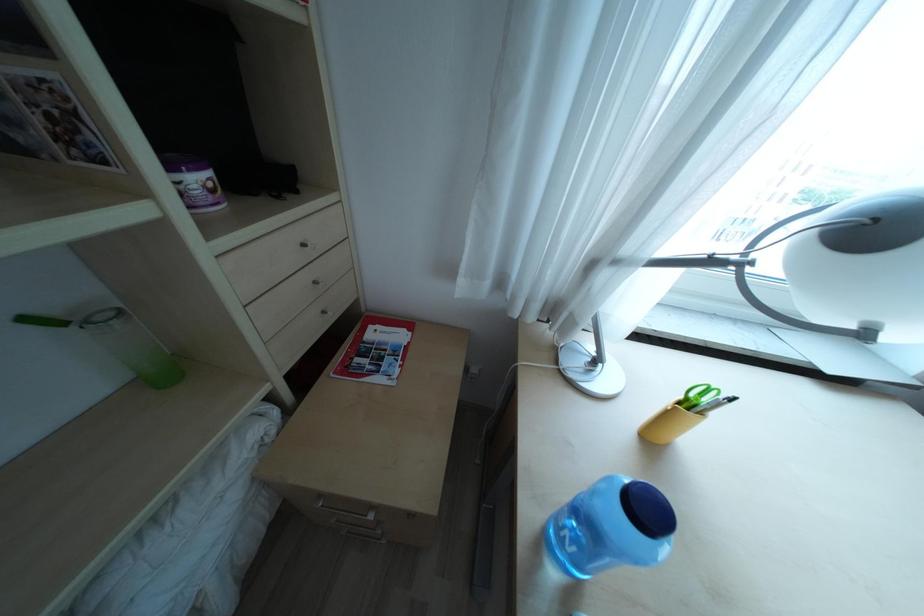
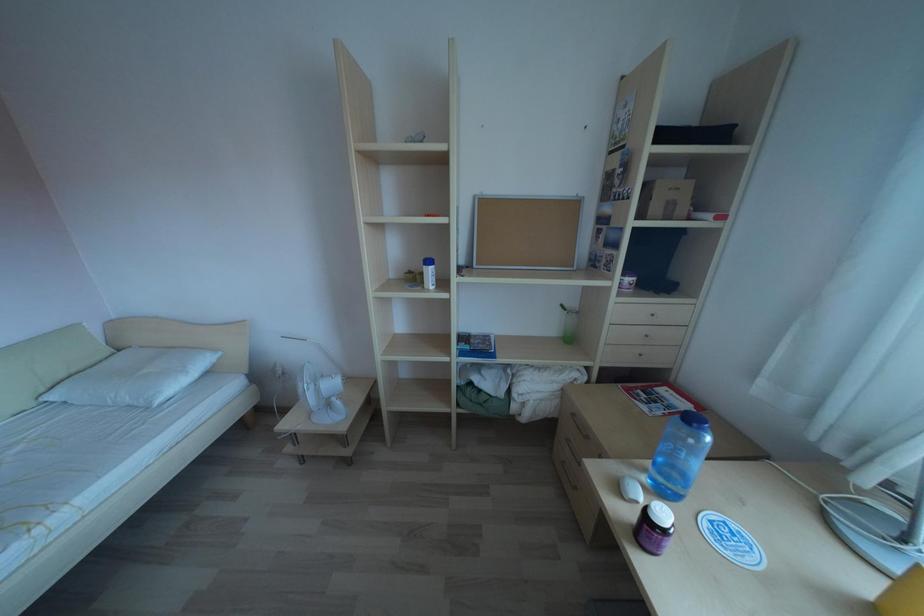
Question: How did the camera likely rotate?

Choices:
 (A) Left
 (B) Right
 (C) Up
 (D) Down

Answer: (A)